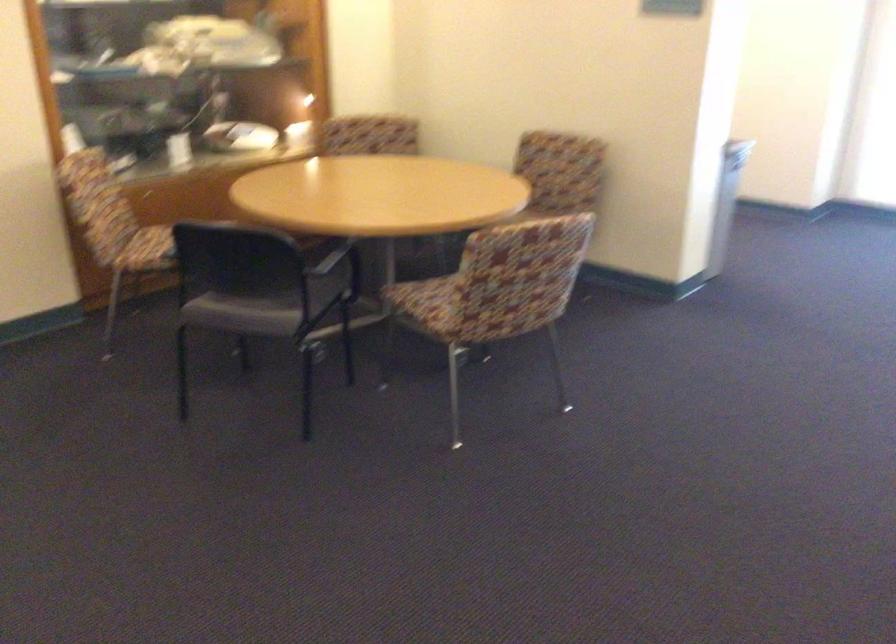
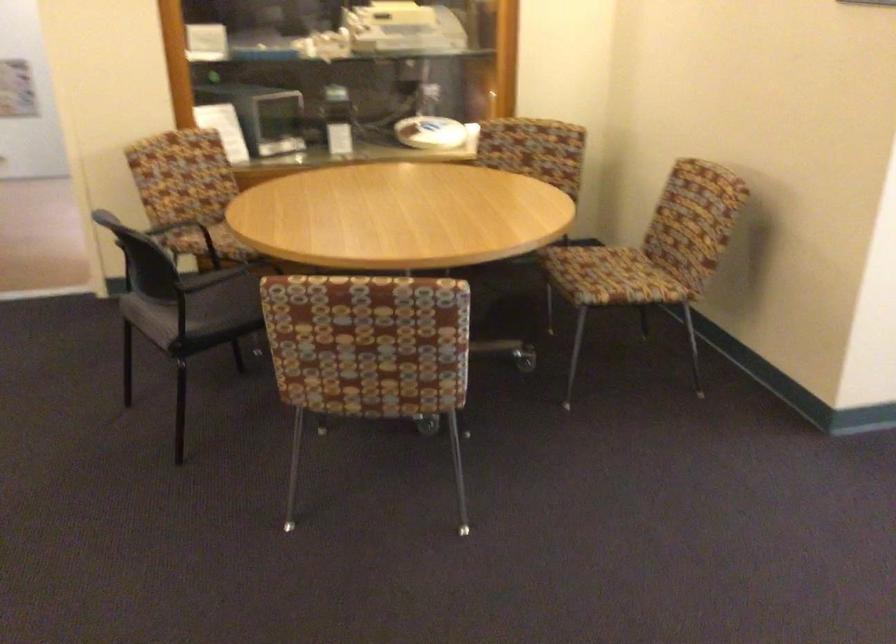
The point at (319, 513) is marked in the first image. Where is the corresponding point in the second image?

(90, 534)